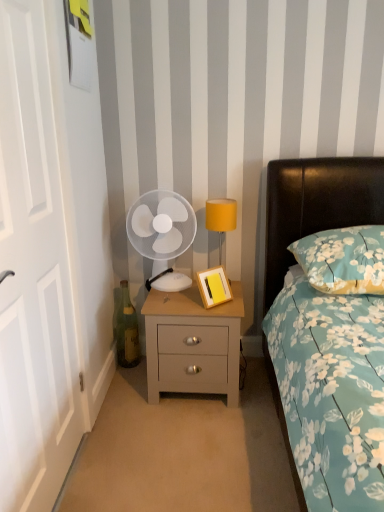
The height and width of the screenshot is (512, 384). Describe the element at coordinates (33, 274) in the screenshot. I see `white wooden door at left` at that location.

Find the location of a particular element. The height and width of the screenshot is (512, 384). white wooden door at left is located at coordinates (33, 274).

The height and width of the screenshot is (512, 384). What do you see at coordinates (214, 287) in the screenshot?
I see `wooden picture frame at bedside table` at bounding box center [214, 287].

This screenshot has width=384, height=512. I want to click on light wood/texture nightstand at center, so click(192, 344).

The width and height of the screenshot is (384, 512). Describe the element at coordinates (316, 205) in the screenshot. I see `teal floral fabric bed at right` at that location.

This screenshot has height=512, width=384. In order to click on white wooden door at left in this screenshot , I will do (x=33, y=274).

Considering the sizes of light wood/texture nightstand at center and floral fabric pillow at right in the image, is light wood/texture nightstand at center wider or thinner than floral fabric pillow at right?

light wood/texture nightstand at center is thinner than floral fabric pillow at right.

Is the position of light wood/texture nightstand at center less distant than that of floral fabric pillow at right?

No, it is behind floral fabric pillow at right.

Is light wood/texture nightstand at center oriented towards floral fabric pillow at right?

No, light wood/texture nightstand at center is not aimed at floral fabric pillow at right.

Looking at this image, considering the relative positions of light wood/texture nightstand at center and floral fabric pillow at right in the image provided, is light wood/texture nightstand at center to the left of floral fabric pillow at right from the viewer's perspective?

Yes, light wood/texture nightstand at center is to the left of floral fabric pillow at right.

From a real-world perspective, which object rests below the other?

light wood/texture nightstand at center.

Does white plastic fan at center have a greater width compared to light wood/texture nightstand at center?

Incorrect, the width of white plastic fan at center does not surpass that of light wood/texture nightstand at center.

Considering the relative sizes of white plastic fan at center and light wood/texture nightstand at center in the image provided, is white plastic fan at center smaller than light wood/texture nightstand at center?

Indeed, white plastic fan at center has a smaller size compared to light wood/texture nightstand at center.

Is white plastic fan at center not close to light wood/texture nightstand at center?

No, white plastic fan at center is not far away from light wood/texture nightstand at center.

The height and width of the screenshot is (512, 384). In the image, there is a wooden picture frame at bedside table. In order to click on bedside lamp above it (from the image's perspective) in this screenshot , I will do tap(221, 218).

Which is more to the right, yellow fabric lampshade at upper right or wooden picture frame at bedside table?

From the viewer's perspective, yellow fabric lampshade at upper right appears more on the right side.

Is yellow fabric lampshade at upper right inside the boundaries of wooden picture frame at bedside table, or outside?

yellow fabric lampshade at upper right is located beyond the bounds of wooden picture frame at bedside table.

Would you say floral fabric pillow at right contains teal floral fabric bed at right?

No, teal floral fabric bed at right is located outside of floral fabric pillow at right.

Is floral fabric pillow at right not near teal floral fabric bed at right?

No, floral fabric pillow at right is not far away from teal floral fabric bed at right.

Image resolution: width=384 pixels, height=512 pixels. What are the coordinates of `bed on the left of floral fabric pillow at right` in the screenshot? It's located at (316, 205).

Considering the relative positions of floral fabric pillow at right and teal floral fabric bed at right in the image provided, is floral fabric pillow at right to the left of teal floral fabric bed at right from the viewer's perspective?

Incorrect, floral fabric pillow at right is not on the left side of teal floral fabric bed at right.

Which is correct: light wood/texture nightstand at center is inside white wooden door at left, or outside of it?

light wood/texture nightstand at center is not enclosed by white wooden door at left.

Which is behind, light wood/texture nightstand at center or white wooden door at left?

light wood/texture nightstand at center is further away from the camera.

Is light wood/texture nightstand at center wider or thinner than white wooden door at left?

In the image, light wood/texture nightstand at center appears to be wider than white wooden door at left.

Which of these two, light wood/texture nightstand at center or white wooden door at left, stands taller?

white wooden door at left is taller.

Which of these two, yellow fabric lampshade at upper right or teal floral fabric bed at right, stands taller?

With more height is teal floral fabric bed at right.

From the image's perspective, does yellow fabric lampshade at upper right appear lower than teal floral fabric bed at right?

No, from the image's perspective, yellow fabric lampshade at upper right is not beneath teal floral fabric bed at right.

Is teal floral fabric bed at right a part of yellow fabric lampshade at upper right?

No, teal floral fabric bed at right is not a part of yellow fabric lampshade at upper right.

Which is in front, point (226, 199) or point (305, 161)?

Positioned in front is point (305, 161).

In the scene shown: From a real-world perspective, which is physically above, light wood/texture nightstand at center or wooden picture frame at bedside table?

From a 3D spatial view, wooden picture frame at bedside table is above.

How much distance is there between light wood/texture nightstand at center and wooden picture frame at bedside table?

They are 20.47 centimeters apart.

Is point (185, 301) more distant than point (213, 304)?

Yes, point (185, 301) is farther from viewer.

Is wooden picture frame at bedside table at the back of light wood/texture nightstand at center?

No, wooden picture frame at bedside table is not at the back of light wood/texture nightstand at center.

The height and width of the screenshot is (512, 384). I want to click on nightstand on the left side of floral fabric pillow at right, so click(192, 344).

What are the coordinates of `mechanical fan above the light wood/texture nightstand at center (from a real-world perspective)` in the screenshot? It's located at (159, 230).

From the image, which object appears to be farther from white wooden door at left, yellow fabric lampshade at upper right or white plastic fan at center?

yellow fabric lampshade at upper right is further to white wooden door at left.

Based on their spatial positions, is teal floral fabric bed at right or floral fabric pillow at right closer to wooden picture frame at bedside table?

teal floral fabric bed at right is closer to wooden picture frame at bedside table.

Estimate the real-world distances between objects in this image. Which object is closer to white plastic fan at center, light wood/texture nightstand at center or teal floral fabric bed at right?

Based on the image, light wood/texture nightstand at center appears to be nearer to white plastic fan at center.

In the scene shown: Estimate the real-world distances between objects in this image. Which object is closer to yellow fabric lampshade at upper right, wooden picture frame at bedside table or light wood/texture nightstand at center?

wooden picture frame at bedside table lies closer to yellow fabric lampshade at upper right than the other object.

When comparing their distances from white plastic fan at center, does white wooden door at left or teal floral fabric bed at right seem closer?

teal floral fabric bed at right lies closer to white plastic fan at center than the other object.

Considering their positions, is yellow fabric lampshade at upper right positioned further to white wooden door at left than teal floral fabric bed at right?

teal floral fabric bed at right.

Estimate the real-world distances between objects in this image. Which object is further from green glass bottle at lower left, floral fabric pillow at right or teal floral fabric bed at right?

floral fabric pillow at right.

Which object lies further to the anchor point white plastic fan at center, floral fabric pillow at right or green glass bottle at lower left?

Among the two, floral fabric pillow at right is located further to white plastic fan at center.

Where is `door between teal floral fabric bed at right and green glass bottle at lower left along the z-axis`? Image resolution: width=384 pixels, height=512 pixels. door between teal floral fabric bed at right and green glass bottle at lower left along the z-axis is located at coordinates (33, 274).

You are a GUI agent. You are given a task and a screenshot of the screen. Output one action in this format:
    pyautogui.click(x=<x>, y=<y>)
    Task: Click on the picture frame between white wooden door at left and yellow fabric lampshade at upper right along the z-axis
    The width and height of the screenshot is (384, 512).
    Given the screenshot: What is the action you would take?
    pyautogui.click(x=214, y=287)

The height and width of the screenshot is (512, 384). Find the location of `pillow between teal floral fabric bed at right and green glass bottle at lower left from front to back`. pillow between teal floral fabric bed at right and green glass bottle at lower left from front to back is located at coordinates (343, 259).

You are a GUI agent. You are given a task and a screenshot of the screen. Output one action in this format:
    pyautogui.click(x=<x>, y=<y>)
    Task: Click on the nightstand between teal floral fabric bed at right and yellow fabric lampshade at upper right in the front-back direction
    The height and width of the screenshot is (512, 384).
    Given the screenshot: What is the action you would take?
    pyautogui.click(x=192, y=344)